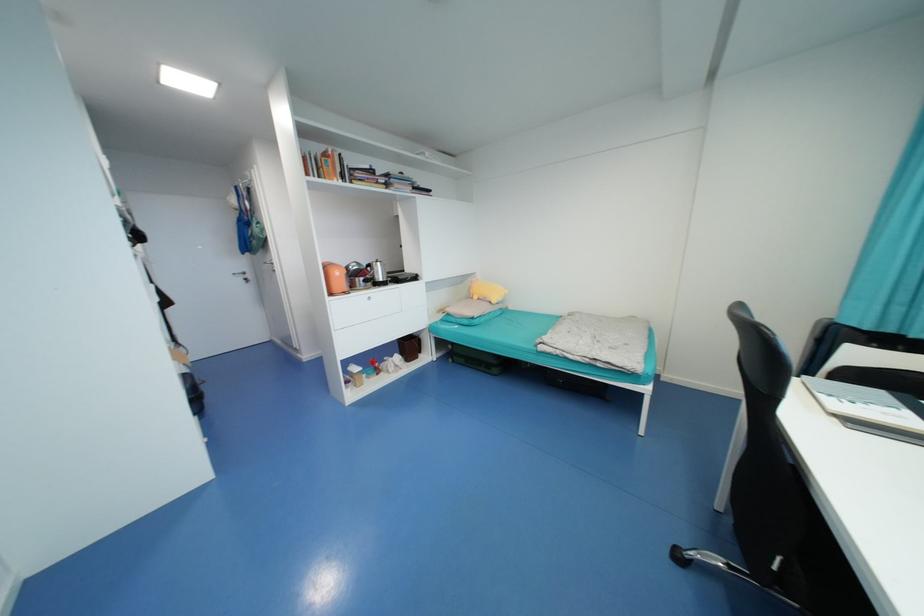
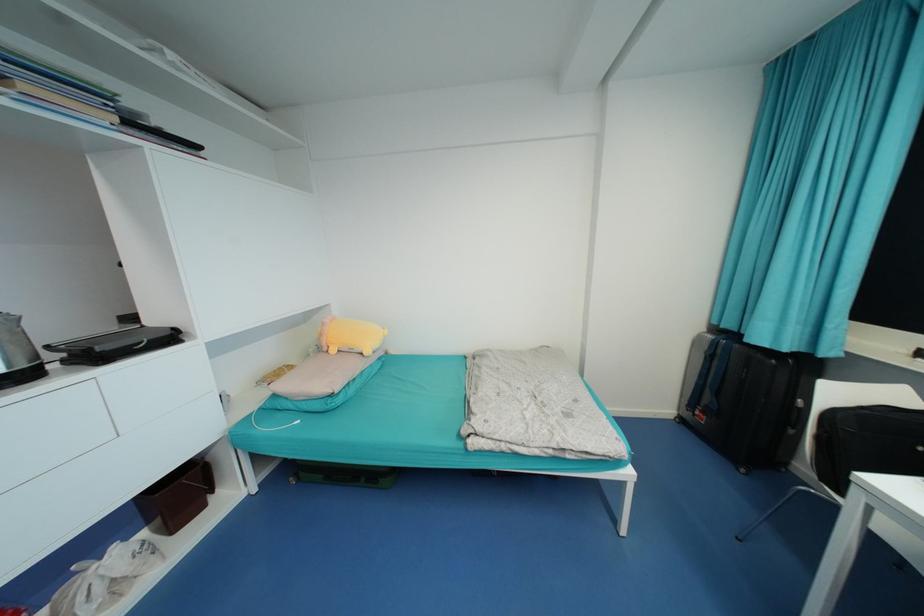
Where in the second image is the point corresponding to [475,288] from the first image?

(325, 334)